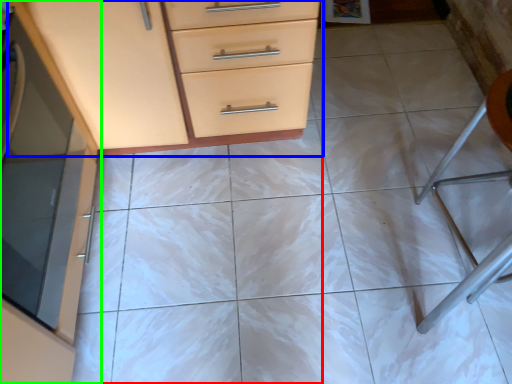
Question: Considering the real-world distances, which object is closest to chest of drawers (highlighted by a red box)? chest of drawers (highlighted by a blue box) or cabinetry (highlighted by a green box).

Choices:
 (A) chest of drawers
 (B) cabinetry

Answer: (A)